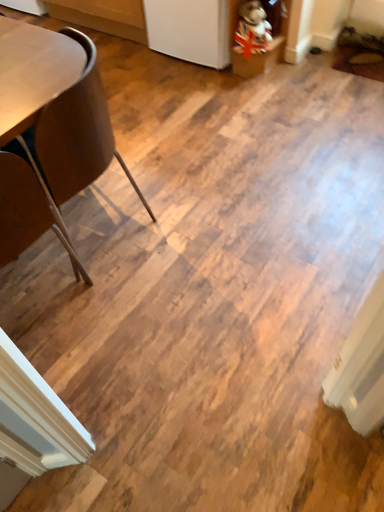
Locate an element on the screen. The image size is (384, 512). free space in front of brown leather chair at left, positioned as the 2th chair in bottom-to-top order is located at coordinates (124, 311).